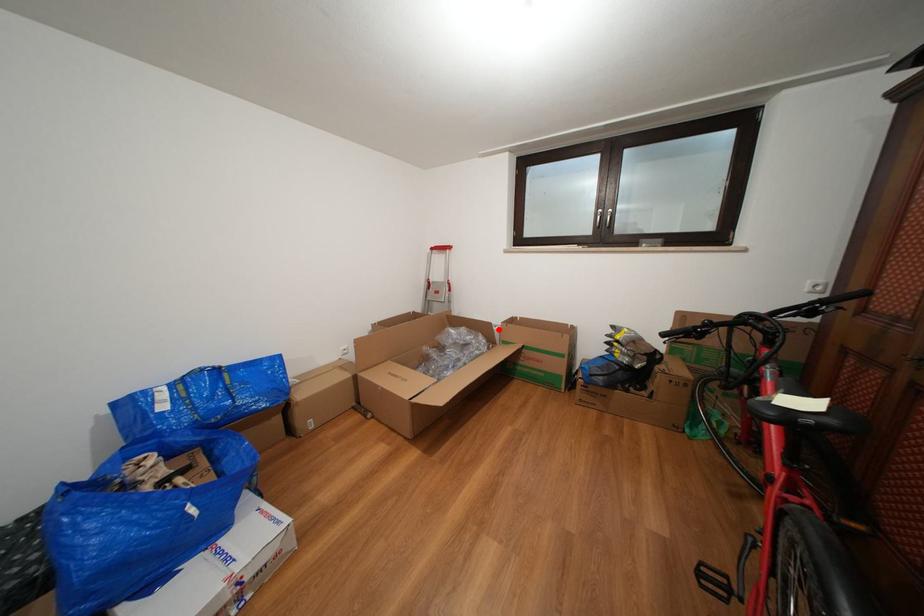
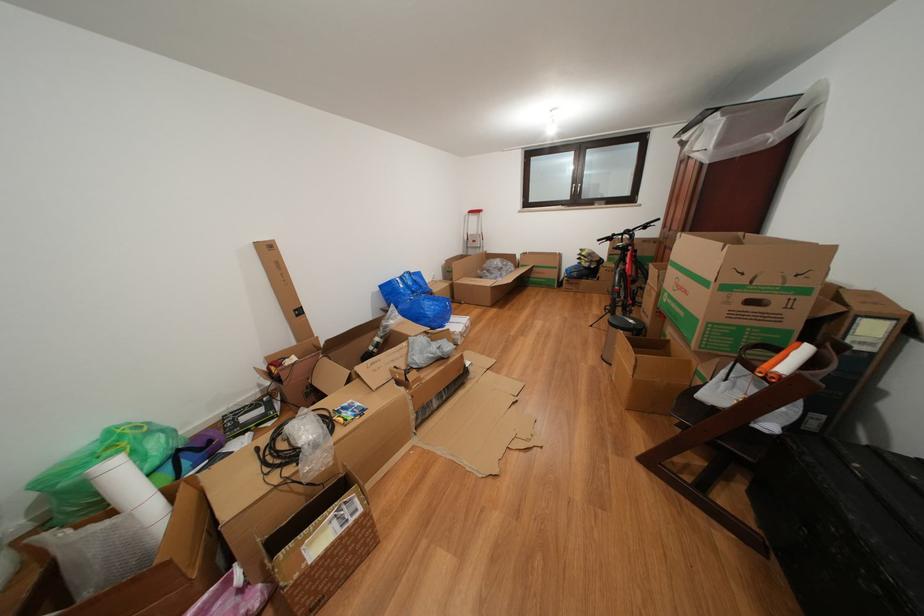
Where in the second image is the point corresponding to the highlighted location from the first image?

(523, 261)